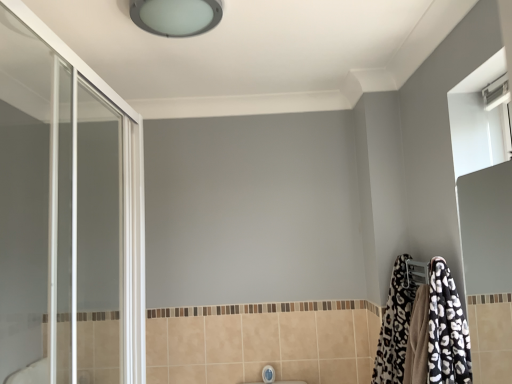
In order to face satin white ceiling light at upper center, should I rotate leftwards or rightwards?

You should look left and rotate roughly 9.759 degrees.

What is the approximate height of transparent glass screen door at left?

It is 1.06 meters.

At what (x,y) coordinates should I click in order to perform the action: click on transparent glass screen door at left. Please return your answer as a coordinate pair (x, y). Looking at the image, I should click on (67, 216).

I want to click on white glossy faucet at lower center, so click(268, 374).

The image size is (512, 384). In order to click on satin white ceiling light at upper center in this screenshot , I will do `click(176, 16)`.

The width and height of the screenshot is (512, 384). I want to click on light fixture lying above the transparent glass screen door at left (from the image's perspective), so (176, 16).

Consider the image. Can you confirm if transparent glass screen door at left is taller than satin white ceiling light at upper center?

Indeed, transparent glass screen door at left has a greater height compared to satin white ceiling light at upper center.

Which is closer to the camera, (38,168) or (210,3)?

Point (38,168) is positioned closer to the camera compared to point (210,3).

Does white glossy faucet at lower center touch black and white leopard print bathrobe at lower right?

No, white glossy faucet at lower center is not in contact with black and white leopard print bathrobe at lower right.

Does white glossy faucet at lower center have a larger size compared to black and white leopard print bathrobe at lower right?

No, white glossy faucet at lower center is not bigger than black and white leopard print bathrobe at lower right.

Between white glossy faucet at lower center and black and white leopard print bathrobe at lower right, which one has larger width?

black and white leopard print bathrobe at lower right is wider.

Does white glossy faucet at lower center contain black and white leopard print bathrobe at lower right?

No, black and white leopard print bathrobe at lower right is not inside white glossy faucet at lower center.

From a real-world perspective, is white glossy faucet at lower center located higher than transparent glass screen door at left?

No, from a real-world perspective, white glossy faucet at lower center is not above transparent glass screen door at left.

Which of these two, white glossy faucet at lower center or transparent glass screen door at left, is smaller?

With smaller size is white glossy faucet at lower center.

From the image's perspective, which is below, white glossy faucet at lower center or transparent glass screen door at left?

white glossy faucet at lower center appears lower in the image.

Who is taller, white glossy faucet at lower center or transparent glass screen door at left?

Standing taller between the two is transparent glass screen door at left.

From a real-world perspective, relative to transparent glass screen door at left, is black and white leopard print bathrobe at lower right vertically above or below?

black and white leopard print bathrobe at lower right is below transparent glass screen door at left.

Is black and white leopard print bathrobe at lower right at the left side of transparent glass screen door at left?

No.

Looking at this image, considering the sizes of black and white leopard print bathrobe at lower right and white glossy faucet at lower center in the image, is black and white leopard print bathrobe at lower right taller or shorter than white glossy faucet at lower center?

In the image, black and white leopard print bathrobe at lower right appears to be taller than white glossy faucet at lower center.

Where is `faucet on the left of black and white leopard print bathrobe at lower right`? The image size is (512, 384). faucet on the left of black and white leopard print bathrobe at lower right is located at coordinates (268, 374).

Which is more to the left, black and white leopard print bathrobe at lower right or white glossy faucet at lower center?

From the viewer's perspective, white glossy faucet at lower center appears more on the left side.

Which object is further away from the camera, black and white leopard print bathrobe at lower right or white glossy faucet at lower center?

Positioned behind is white glossy faucet at lower center.

From the image's perspective, would you say white glossy faucet at lower center is positioned over satin white ceiling light at upper center?

Actually, white glossy faucet at lower center appears below satin white ceiling light at upper center in the image.

From a real-world perspective, which object stands above the other?

From a 3D spatial view, satin white ceiling light at upper center is above.

Is black and white leopard print bathrobe at lower right located outside satin white ceiling light at upper center?

That's correct, black and white leopard print bathrobe at lower right is outside of satin white ceiling light at upper center.

Can you confirm if black and white leopard print bathrobe at lower right is positioned to the left of satin white ceiling light at upper center?

No.

Are black and white leopard print bathrobe at lower right and satin white ceiling light at upper center located far from each other?

Yes.

Does black and white leopard print bathrobe at lower right turn towards satin white ceiling light at upper center?

No, black and white leopard print bathrobe at lower right is not aimed at satin white ceiling light at upper center.

Locate an element on the screen. The height and width of the screenshot is (384, 512). screen door located in front of the satin white ceiling light at upper center is located at coordinates tap(67, 216).

Image resolution: width=512 pixels, height=384 pixels. I want to click on faucet below the black and white leopard print bathrobe at lower right (from the image's perspective), so click(x=268, y=374).

When comparing their distances from transparent glass screen door at left, does black and white leopard print bathrobe at lower right or white glossy faucet at lower center seem further?

white glossy faucet at lower center lies further to transparent glass screen door at left than the other object.

Based on their spatial positions, is black and white leopard print bathrobe at lower right or transparent glass screen door at left closer to satin white ceiling light at upper center?

transparent glass screen door at left is closer to satin white ceiling light at upper center.

Which object lies nearer to the anchor point satin white ceiling light at upper center, transparent glass screen door at left or white glossy faucet at lower center?

The object closer to satin white ceiling light at upper center is transparent glass screen door at left.

Looking at the image, which one is located closer to transparent glass screen door at left, satin white ceiling light at upper center or black and white leopard print bathrobe at lower right?

satin white ceiling light at upper center is positioned closer to the anchor transparent glass screen door at left.

From the image, which object appears to be nearer to white glossy faucet at lower center, black and white leopard print bathrobe at lower right or transparent glass screen door at left?

black and white leopard print bathrobe at lower right is positioned closer to the anchor white glossy faucet at lower center.

Which object lies nearer to the anchor point white glossy faucet at lower center, transparent glass screen door at left or satin white ceiling light at upper center?

transparent glass screen door at left is positioned closer to the anchor white glossy faucet at lower center.

Based on their spatial positions, is transparent glass screen door at left or black and white leopard print bathrobe at lower right further from white glossy faucet at lower center?

transparent glass screen door at left.

In the scene shown: Estimate the real-world distances between objects in this image. Which object is closer to satin white ceiling light at upper center, white glossy faucet at lower center or transparent glass screen door at left?

The object closer to satin white ceiling light at upper center is transparent glass screen door at left.

You are a GUI agent. You are given a task and a screenshot of the screen. Output one action in this format:
    pyautogui.click(x=<x>, y=<y>)
    Task: Click on the light fixture positioned between transparent glass screen door at left and white glossy faucet at lower center from near to far
    
    Given the screenshot: What is the action you would take?
    pyautogui.click(x=176, y=16)

This screenshot has width=512, height=384. In order to click on light fixture between transparent glass screen door at left and black and white leopard print bathrobe at lower right in the horizontal direction in this screenshot , I will do `click(176, 16)`.

What are the coordinates of `bathrobe between satin white ceiling light at upper center and white glossy faucet at lower center in the up-down direction` in the screenshot? It's located at (446, 329).

Locate an element on the screen. bathrobe between transparent glass screen door at left and white glossy faucet at lower center from front to back is located at coordinates (446, 329).